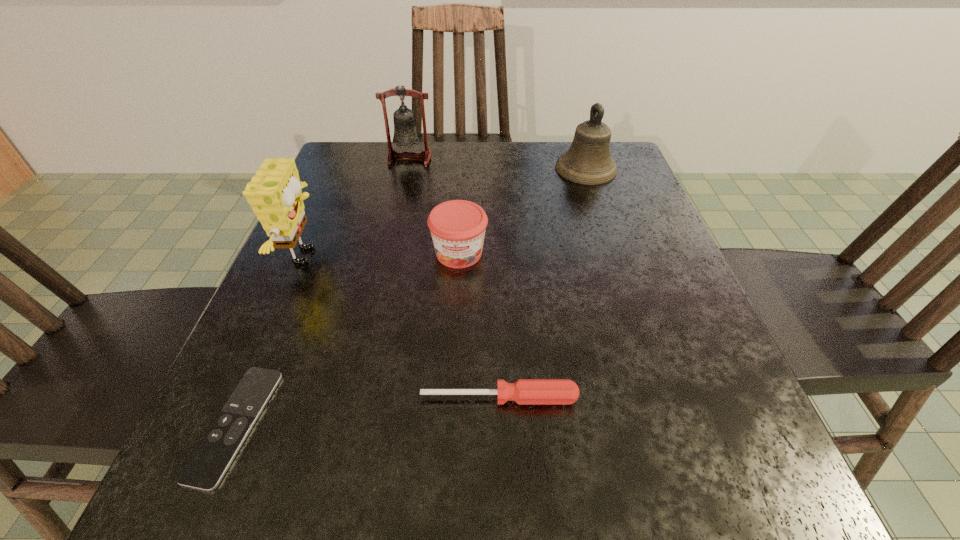
Identify the location of free space that satisfies the following two spatial constraints: 1. on the front-facing side of the remote control; 2. on the right side of the sponge. (235, 424).

Image resolution: width=960 pixels, height=540 pixels. Find the location of `free space that satisfies the following two spatial constraints: 1. on the front side of the fourth object from right to left; 2. on the right side of the second shortest object`. free space that satisfies the following two spatial constraints: 1. on the front side of the fourth object from right to left; 2. on the right side of the second shortest object is located at coordinates (355, 398).

Locate an element on the screen. The width and height of the screenshot is (960, 540). vacant area in the image that satisfies the following two spatial constraints: 1. on the back side of the screwdriver; 2. on the right side of the remote control is located at coordinates point(247,398).